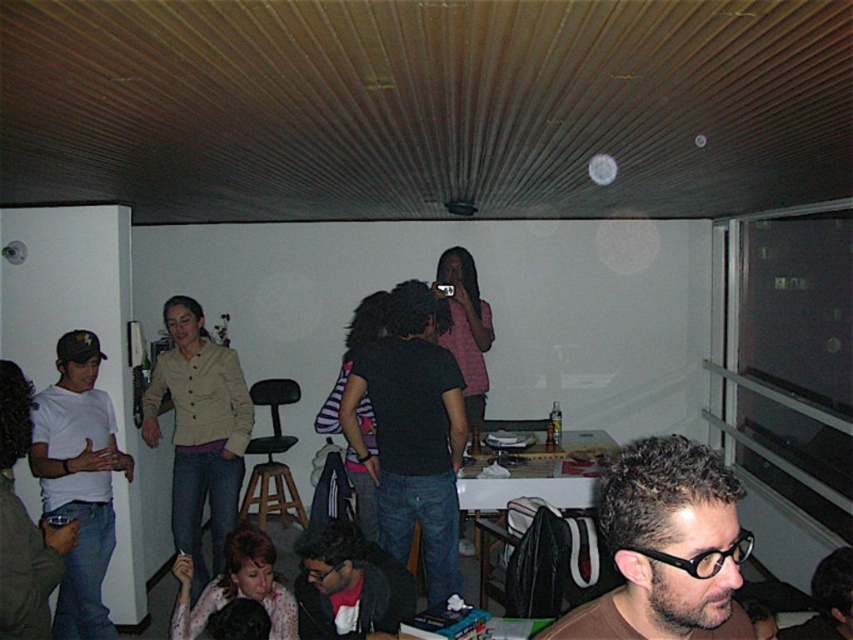
Question: Among these points, which one is farthest from the camera?

Choices:
 (A) (636, 442)
 (B) (839, 595)
 (C) (328, 525)
 (D) (44, 401)

Answer: (A)

Question: Which of the following is the closest to the observer?

Choices:
 (A) white matte t-shirt at left
 (B) dark brown curly hair at lower right

Answer: (B)

Question: Which object is farther from the camera taking this photo?

Choices:
 (A) dark brown curly hair at lower right
 (B) brown leather glasses at lower right
 (C) white matte t-shirt at left

Answer: (C)

Question: Does dark brown curly hair at lower right have a lesser width compared to wooden bar stool at center?

Choices:
 (A) yes
 (B) no

Answer: (A)

Question: Is white matte t-shirt at left wider than brown leather glasses at lower right?

Choices:
 (A) yes
 (B) no

Answer: (B)

Question: Is wooden bar stool at center below brown leather glasses at lower right?

Choices:
 (A) no
 (B) yes

Answer: (A)